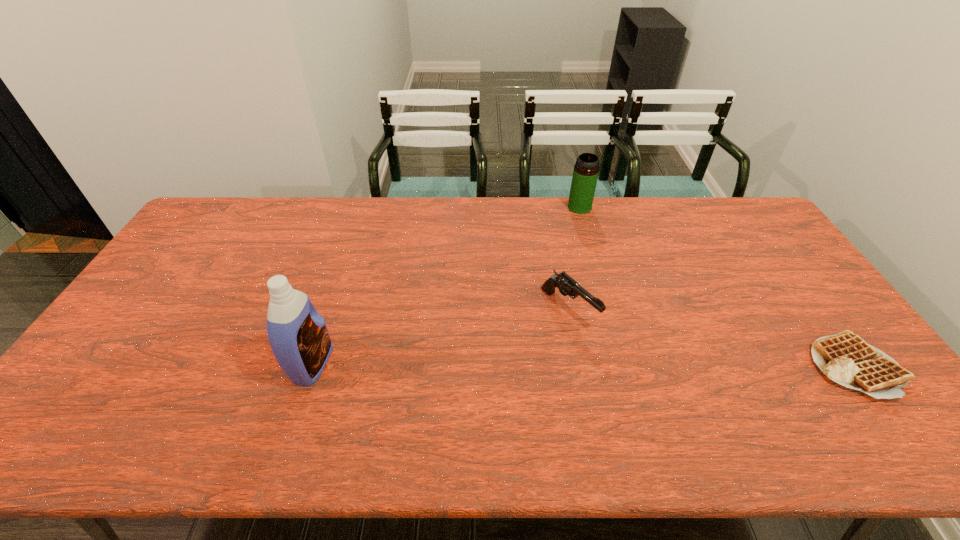
Image resolution: width=960 pixels, height=540 pixels. Find the location of `vacant space at the far edge of the desktop`. vacant space at the far edge of the desktop is located at coordinates (522, 228).

In the image, there is a desktop. Where is `vacant space at the near edge`? vacant space at the near edge is located at coordinates (703, 387).

The image size is (960, 540). What are the coordinates of `vacant space at the left edge` in the screenshot? It's located at (156, 294).

Identify the location of vacant point at the right edge. The width and height of the screenshot is (960, 540). (743, 259).

In order to click on vacant space at the far left corner of the desktop in this screenshot , I will do `click(197, 226)`.

The height and width of the screenshot is (540, 960). In order to click on vacant position at the far right corner of the desktop in this screenshot , I will do `click(737, 237)`.

Identify the location of free space between the shortest object and the gun. (711, 337).

The width and height of the screenshot is (960, 540). I want to click on vacant point located between the shortest object and the tallest object, so click(x=584, y=364).

At what (x,y) coordinates should I click in order to perform the action: click on vacant area that lies between the leftmost object and the third tallest object. Please return your answer as a coordinate pair (x, y). Looking at the image, I should click on (441, 336).

Where is `free space between the third tallest object and the detergent`? free space between the third tallest object and the detergent is located at coordinates (441, 336).